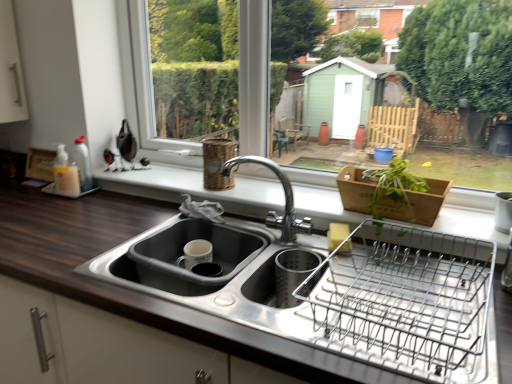
Question: In terms of width, does chrome metallic faucet at center look wider or thinner when compared to wooden basket at center?

Choices:
 (A) thin
 (B) wide

Answer: (A)

Question: In the image, is chrome metallic faucet at center on the left side or the right side of wooden basket at center?

Choices:
 (A) left
 (B) right

Answer: (A)

Question: Which object is the farthest from the white plastic window frame at upper center?

Choices:
 (A) wooden basket at center
 (B) matte gray sink at lower center
 (C) woven brown basket at upper center
 (D) dark wood countertop at center
 (E) metallic wire dish rack at right

Answer: (C)

Question: Which is farther from the chrome metallic faucet at center?

Choices:
 (A) wooden basket at center
 (B) woven brown basket at upper center
 (C) metallic wire dish rack at right
 (D) matte gray sink at lower center
 (E) dark wood countertop at center

Answer: (E)